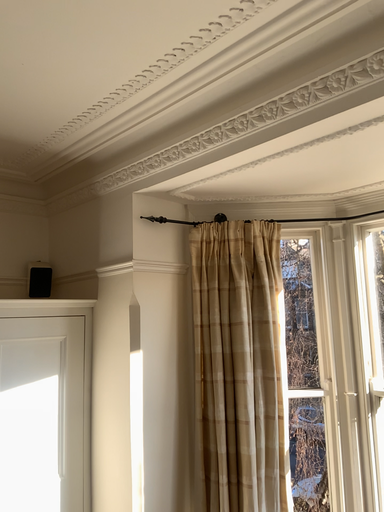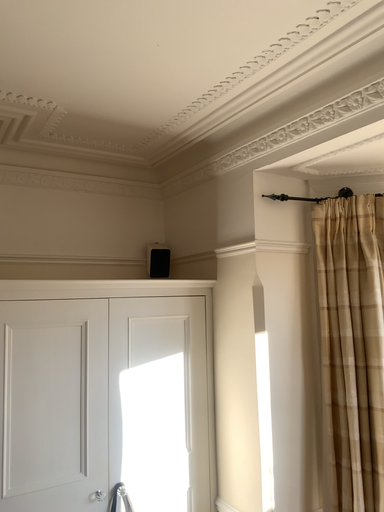
Question: How did the camera likely rotate when shooting the video?

Choices:
 (A) rotated left
 (B) rotated right

Answer: (A)